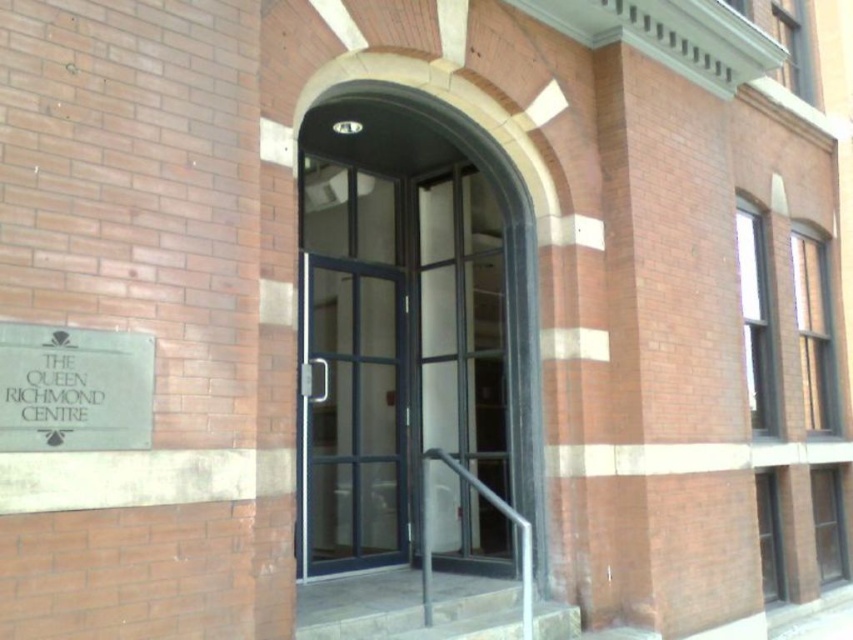
Question: Which object is the closest to the matte glass door at center?

Choices:
 (A) silver metallic sign at lower left
 (B) gray concrete stairs at lower center

Answer: (B)

Question: Where is silver metallic sign at lower left located in relation to matte glass door at center in the image?

Choices:
 (A) left
 (B) right

Answer: (A)

Question: Is matte glass door at center bigger than gray concrete stairs at lower center?

Choices:
 (A) yes
 (B) no

Answer: (A)

Question: Considering the real-world distances, which object is closest to the matte glass door at center?

Choices:
 (A) gray concrete stairs at lower center
 (B) silver metallic sign at lower left

Answer: (A)

Question: Can you confirm if silver metallic sign at lower left is positioned to the left of matte glass door at center?

Choices:
 (A) no
 (B) yes

Answer: (B)

Question: Which object appears closest to the camera in this image?

Choices:
 (A) matte glass door at center
 (B) gray concrete stairs at lower center

Answer: (B)